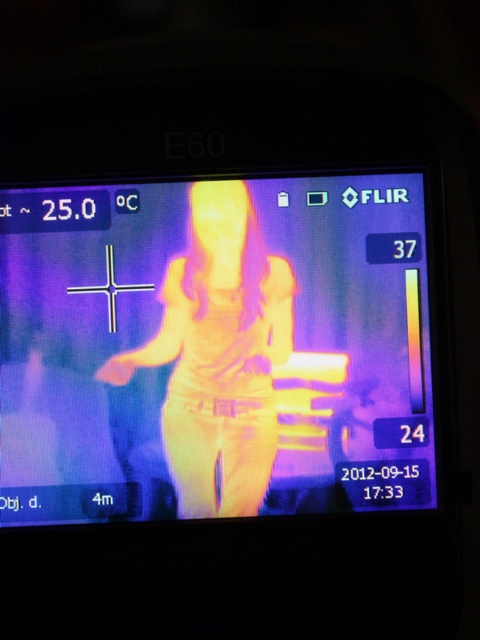
In the scene shown: You are holding a thermal imaging device and notice a yellow metallic phone at center in the image. If you want to place a small object that requires a 1.2 meter clearance between it and the phone, is the current distance sufficient?

The distance between the yellow metallic phone at center and the viewer is 1.12 meters, which is less than the required 1.2 meters clearance. Therefore, the current distance is insufficient.